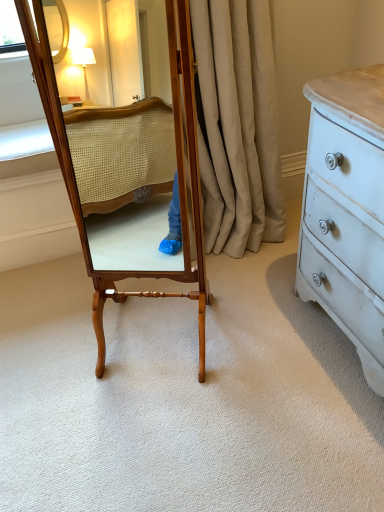
Describe the element at coordinates (237, 125) in the screenshot. The height and width of the screenshot is (512, 384). I see `beige fabric curtain at center` at that location.

Locate an element on the screen. The height and width of the screenshot is (512, 384). beige fabric curtain at center is located at coordinates (237, 125).

What are the coordinates of `beige fabric curtain at center` in the screenshot? It's located at (237, 125).